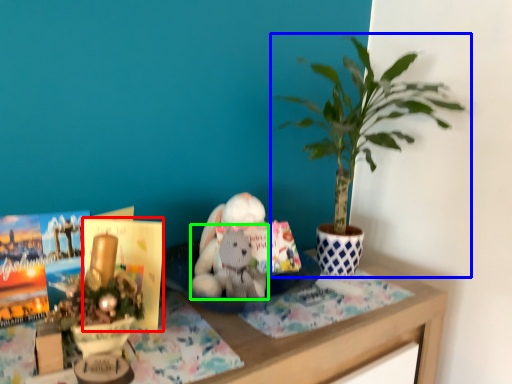
Question: Which object is positioned closest to paperback book (highlighted by a red box)? Select from houseplant (highlighted by a blue box) and animal (highlighted by a green box).

Choices:
 (A) houseplant
 (B) animal

Answer: (B)